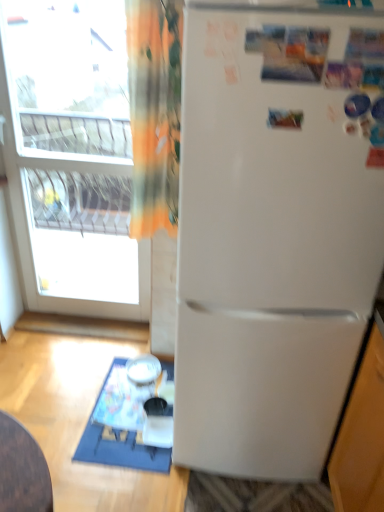
The height and width of the screenshot is (512, 384). What do you see at coordinates (71, 160) in the screenshot?
I see `transparent glass window at upper left` at bounding box center [71, 160].

Describe the element at coordinates (117, 432) in the screenshot. The width and height of the screenshot is (384, 512). I see `white plastic table at lower left` at that location.

Where is `white matte refrigerator at center`? This screenshot has width=384, height=512. white matte refrigerator at center is located at coordinates (273, 233).

Between orange fabric curtain at upper left and white plastic table at lower left, which one has larger size?

orange fabric curtain at upper left.

From the image's perspective, would you say orange fabric curtain at upper left is positioned over white plastic table at lower left?

Yes, from the image's perspective, orange fabric curtain at upper left is above white plastic table at lower left.

Looking at this image, which of these two, orange fabric curtain at upper left or white plastic table at lower left, is wider?

Wider between the two is white plastic table at lower left.

Would you say white plastic table at lower left contains white glossy bowl at lower center?

That's incorrect, white glossy bowl at lower center is not inside white plastic table at lower left.

From a real-world perspective, which is physically below, white plastic table at lower left or white glossy bowl at lower center?

white plastic table at lower left is physically lower.

Can you confirm if white plastic table at lower left is taller than white glossy bowl at lower center?

No.

Can you confirm if orange fabric curtain at upper left is positioned to the right of transparent glass window at upper left?

Indeed, orange fabric curtain at upper left is positioned on the right side of transparent glass window at upper left.

What's the angular difference between orange fabric curtain at upper left and transparent glass window at upper left's facing directions?

The angle between the facing direction of orange fabric curtain at upper left and the facing direction of transparent glass window at upper left is 0.0491 degrees.

Which is behind, orange fabric curtain at upper left or transparent glass window at upper left?

transparent glass window at upper left is more distant.

Considering the sizes of orange fabric curtain at upper left and transparent glass window at upper left in the image, is orange fabric curtain at upper left taller or shorter than transparent glass window at upper left?

Clearly, orange fabric curtain at upper left is shorter compared to transparent glass window at upper left.

Looking at this image, what's the angular difference between white plastic table at lower left and white matte refrigerator at center's facing directions?

There is a 0.434-degree angle between the facing directions of white plastic table at lower left and white matte refrigerator at center.

Is white plastic table at lower left bigger or smaller than white matte refrigerator at center?

In the image, white plastic table at lower left appears to be smaller than white matte refrigerator at center.

Is white plastic table at lower left facing towards white matte refrigerator at center?

No.

Is white plastic table at lower left further to camera compared to white matte refrigerator at center?

That is True.

From the picture: Considering the sizes of objects white glossy bowl at lower center and white plastic table at lower left in the image provided, who is thinner, white glossy bowl at lower center or white plastic table at lower left?

Thinner between the two is white glossy bowl at lower center.

Does white glossy bowl at lower center lie behind white plastic table at lower left?

Yes.

In the scene shown: Can you confirm if white glossy bowl at lower center is shorter than white plastic table at lower left?

Incorrect, the height of white glossy bowl at lower center does not fall short of that of white plastic table at lower left.

Is white glossy bowl at lower center positioned far away from white plastic table at lower left?

No.

From the picture: What's the angular difference between white plastic table at lower left and transparent glass window at upper left's facing directions?

There is a 0.385-degree angle between the facing directions of white plastic table at lower left and transparent glass window at upper left.

From a real-world perspective, is white plastic table at lower left located beneath transparent glass window at upper left?

Indeed, from a real-world perspective, white plastic table at lower left is positioned beneath transparent glass window at upper left.

Consider the image. Which of these two, white plastic table at lower left or transparent glass window at upper left, stands taller?

With more height is transparent glass window at upper left.

Locate an element on the screen. Image resolution: width=384 pixels, height=512 pixels. appliance located behind the orange fabric curtain at upper left is located at coordinates (143, 369).

Is white glossy bowl at lower center next to orange fabric curtain at upper left and touching it?

No, white glossy bowl at lower center is not in contact with orange fabric curtain at upper left.

From a real-world perspective, who is located higher, white glossy bowl at lower center or orange fabric curtain at upper left?

In real-world perspective, orange fabric curtain at upper left is above.

Does point (157, 377) come behind point (147, 133)?

Yes, point (157, 377) is behind point (147, 133).

Where is `table below the orange fabric curtain at upper left (from the image's perspective)`? Image resolution: width=384 pixels, height=512 pixels. table below the orange fabric curtain at upper left (from the image's perspective) is located at coordinates (117, 432).

You are a GUI agent. You are given a task and a screenshot of the screen. Output one action in this format:
    pyautogui.click(x=<x>, y=<y>)
    Task: Click on the appliance on the right of white plastic table at lower left
    The height and width of the screenshot is (512, 384).
    Given the screenshot: What is the action you would take?
    pyautogui.click(x=143, y=369)

Estimate the real-world distances between objects in this image. Which object is further from white glossy bowl at lower center, orange fabric curtain at upper left or transparent glass window at upper left?

transparent glass window at upper left lies further to white glossy bowl at lower center than the other object.

Estimate the real-world distances between objects in this image. Which object is closer to orange fabric curtain at upper left, transparent glass window at upper left or white glossy bowl at lower center?

white glossy bowl at lower center.

In the scene shown: From the image, which object appears to be farther from transparent glass window at upper left, white plastic table at lower left or orange fabric curtain at upper left?

The object further to transparent glass window at upper left is orange fabric curtain at upper left.

When comparing their distances from white matte refrigerator at center, does transparent glass window at upper left or white plastic table at lower left seem closer?

The object closer to white matte refrigerator at center is white plastic table at lower left.

Estimate the real-world distances between objects in this image. Which object is further from white matte refrigerator at center, white glossy bowl at lower center or transparent glass window at upper left?

→ transparent glass window at upper left is positioned further to the anchor white matte refrigerator at center.

From the image, which object appears to be nearer to orange fabric curtain at upper left, white matte refrigerator at center or white glossy bowl at lower center?

white matte refrigerator at center is closer to orange fabric curtain at upper left.

When comparing their distances from white matte refrigerator at center, does white glossy bowl at lower center or orange fabric curtain at upper left seem closer?

The object closer to white matte refrigerator at center is orange fabric curtain at upper left.

Based on their spatial positions, is white glossy bowl at lower center or white matte refrigerator at center further from white plastic table at lower left?

white matte refrigerator at center is further to white plastic table at lower left.

Identify the location of refrigerator between transparent glass window at upper left and white plastic table at lower left in the up-down direction. (273, 233).

In order to click on window that lies between orange fabric curtain at upper left and white glossy bowl at lower center from top to bottom in this screenshot , I will do `click(71, 160)`.

This screenshot has width=384, height=512. Identify the location of curtain located between transparent glass window at upper left and white matte refrigerator at center in the left-right direction. (154, 112).

Locate an element on the screen. appliance between transparent glass window at upper left and white plastic table at lower left in the up-down direction is located at coordinates (143, 369).